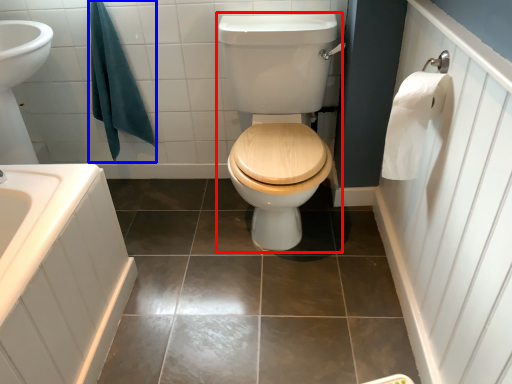
Question: Which point is further to the camera, sit (highlighted by a red box) or bath towel (highlighted by a blue box)?

Choices:
 (A) sit
 (B) bath towel

Answer: (B)